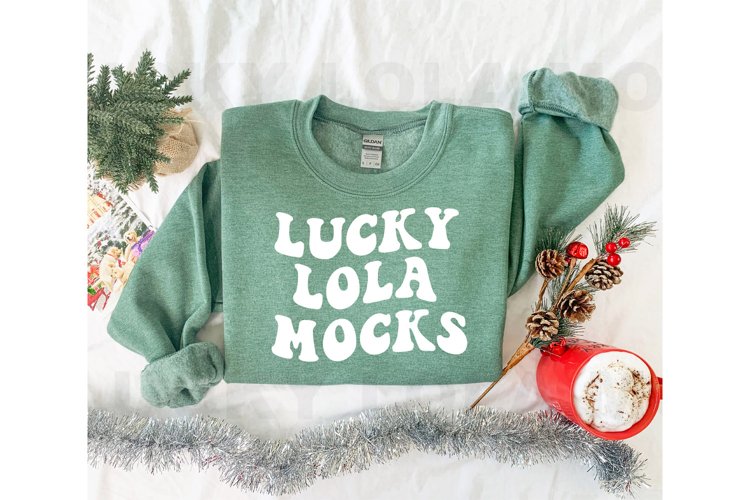
I want to click on tinsel garland, so click(x=352, y=442).